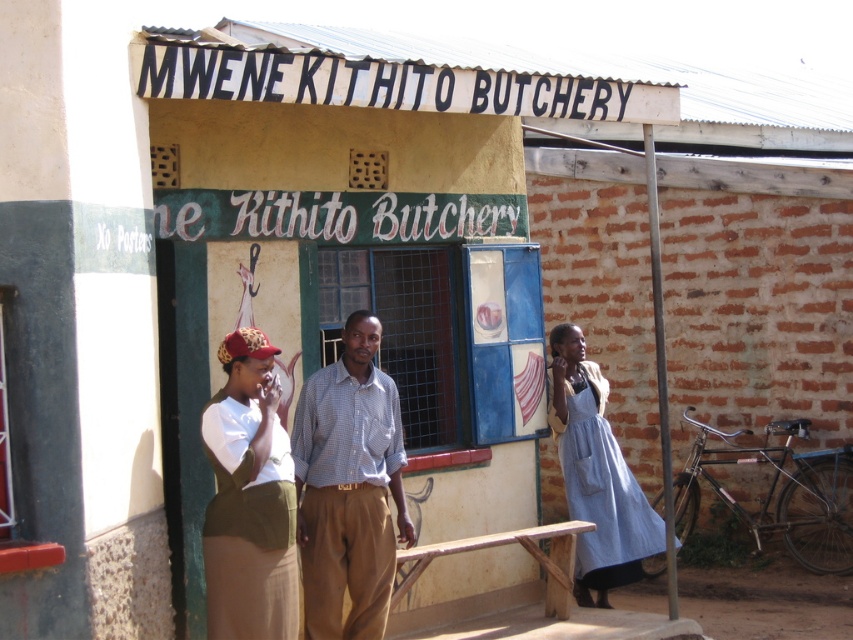
Question: Considering the relative positions of checkered fabric shirt at center and denim dress at right in the image provided, where is checkered fabric shirt at center located with respect to denim dress at right?

Choices:
 (A) above
 (B) below

Answer: (A)

Question: Which object appears closest to the camera in this image?

Choices:
 (A) matte khaki vest at left
 (B) checkered fabric shirt at center

Answer: (A)

Question: Can you confirm if checkered fabric shirt at center is positioned below denim dress at right?

Choices:
 (A) no
 (B) yes

Answer: (A)

Question: Estimate the real-world distances between objects in this image. Which object is closer to the matte khaki vest at left?

Choices:
 (A) denim dress at right
 (B) checkered fabric shirt at center

Answer: (B)

Question: Based on their relative distances, which object is farther from the checkered fabric shirt at center?

Choices:
 (A) denim dress at right
 (B) matte khaki vest at left

Answer: (A)

Question: Is matte khaki vest at left to the left of denim dress at right from the viewer's perspective?

Choices:
 (A) no
 (B) yes

Answer: (B)